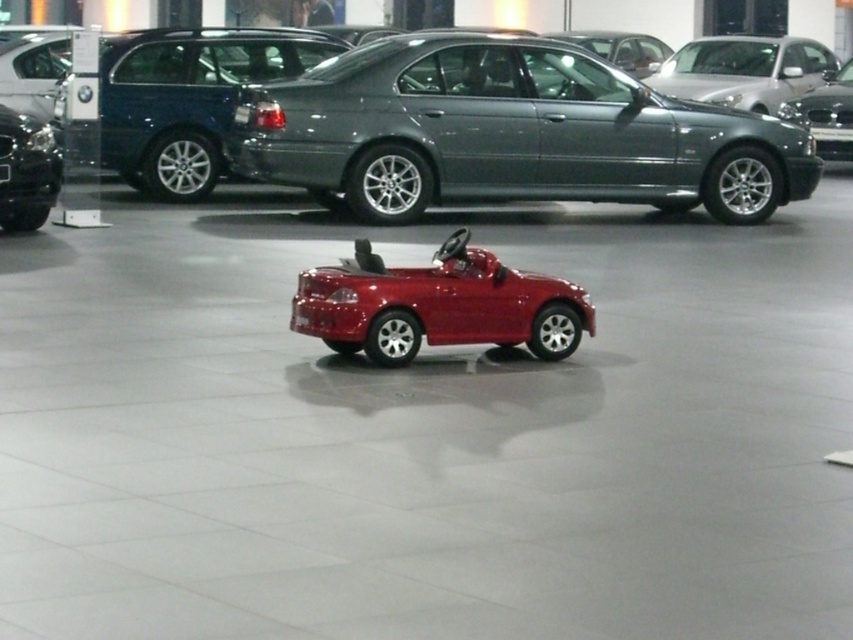
Question: Is metallic gray sedan at center to the left of shiny red toy car at center from the viewer's perspective?

Choices:
 (A) no
 (B) yes

Answer: (A)

Question: Which object is farther from the camera taking this photo?

Choices:
 (A) satin silver sedan at upper right
 (B) metallic gray sedan at center
 (C) shiny black car at left

Answer: (A)

Question: Can you confirm if shiny red toy car at center is positioned to the right of glossy metallic sedan at upper right?

Choices:
 (A) yes
 (B) no

Answer: (B)

Question: Considering the relative positions of satin silver sedan at upper right and shiny black car at left in the image provided, where is satin silver sedan at upper right located with respect to shiny black car at left?

Choices:
 (A) right
 (B) left

Answer: (A)

Question: Which object is closer to the camera taking this photo?

Choices:
 (A) shiny red toy car at center
 (B) satin silver sedan at upper right

Answer: (A)

Question: Which object appears farthest from the camera in this image?

Choices:
 (A) shiny black car at left
 (B) satin silver sedan at upper right
 (C) shiny red toy car at center
 (D) glossy metallic sedan at upper right

Answer: (B)